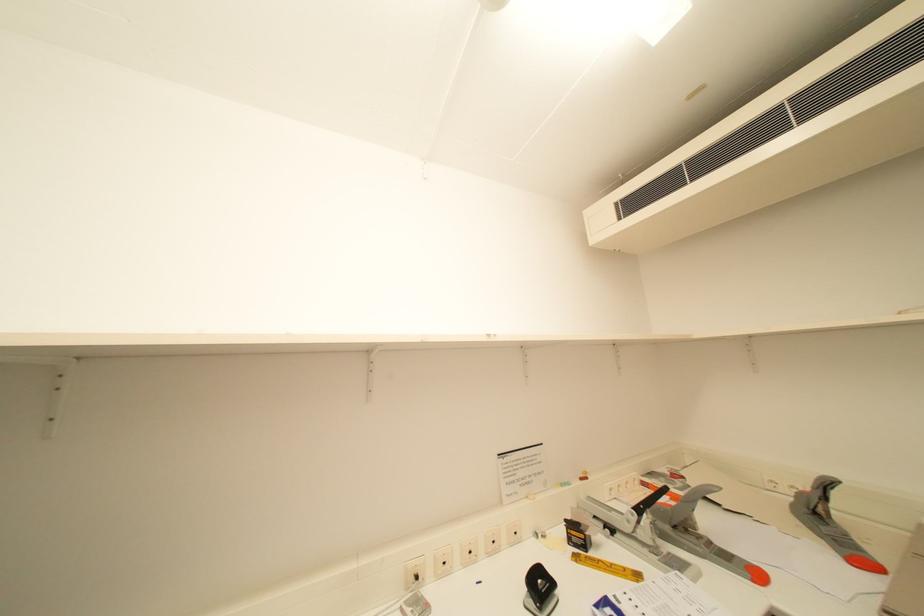
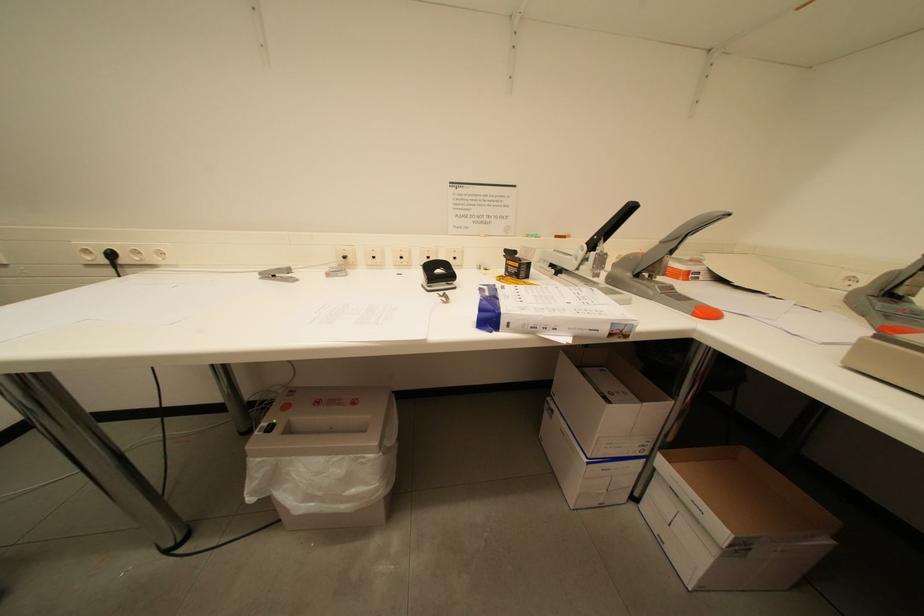
The first image is from the beginning of the video and the second image is from the end. How did the camera likely rotate when shooting the video?

The rotation direction of the camera is left-down.